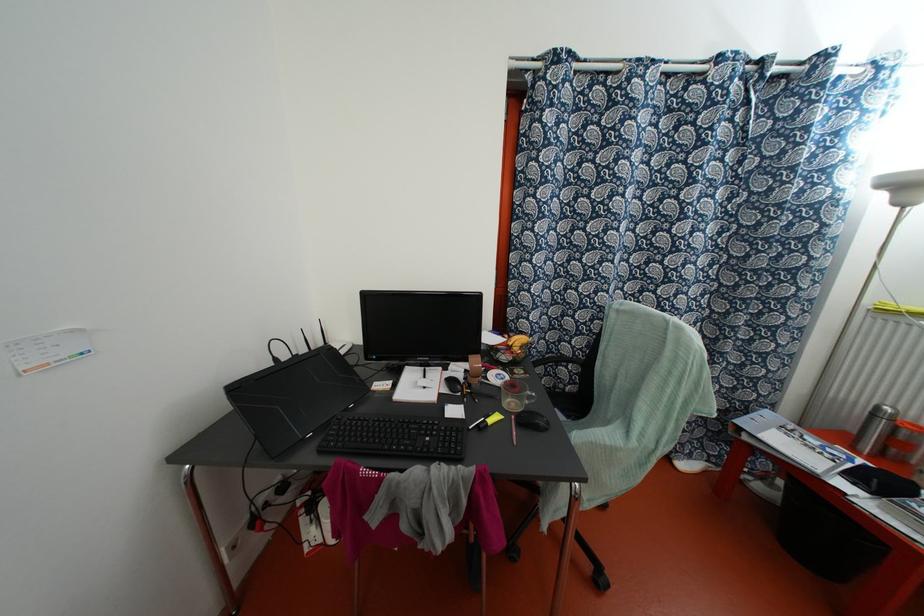
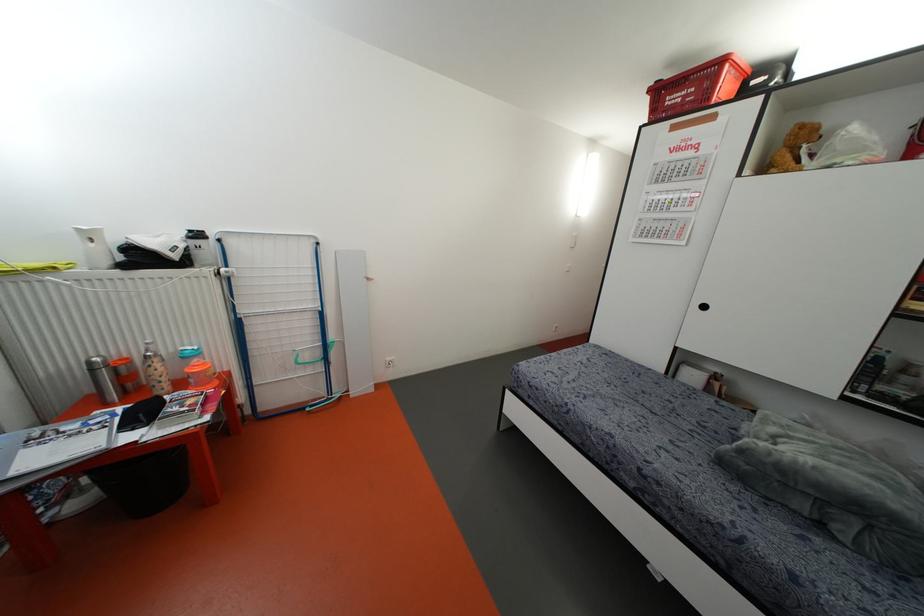
Locate, in the second image, the point that corresponds to (872,415) in the first image.

(91, 370)